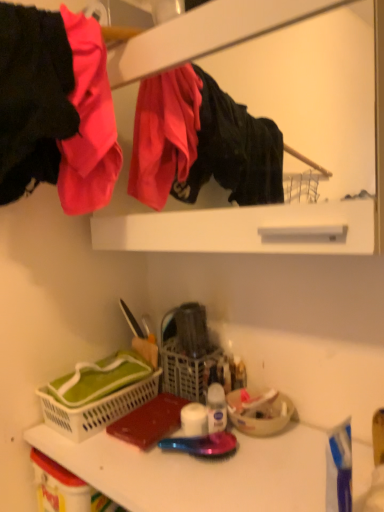
At what (x,y) coordinates should I click in order to perform the action: click on blank space situated above white plastic counter top at lower center (from a real-world perspective). Please return your answer as a coordinate pair (x, y). Looking at the image, I should click on (210, 466).